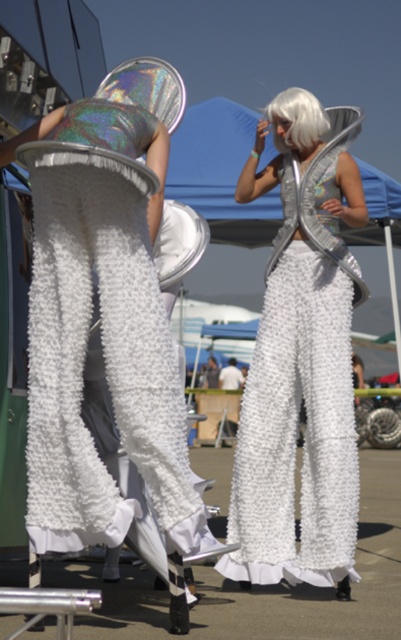
Question: Can you confirm if white fluffy pants at center is positioned to the right of white fluffy wig at upper center?

Choices:
 (A) yes
 (B) no

Answer: (B)

Question: Which object is positioned farthest from the metallic silver pole at center?

Choices:
 (A) white fluffy wig at upper center
 (B) shiny metallic vest at center
 (C) metallic silver canopy at upper center

Answer: (C)

Question: Which point is farther from the camera taking this photo?

Choices:
 (A) pos(62,224)
 (B) pos(287,106)

Answer: (B)

Question: Observing the image, what is the correct spatial positioning of white fluffy pants at center in reference to metallic silver pole at center?

Choices:
 (A) left
 (B) right

Answer: (B)

Question: Based on their relative distances, which object is farther from the white fluffy wig at upper center?

Choices:
 (A) metallic silver pole at center
 (B) metallic silver canopy at upper center
 (C) shiny metallic vest at center

Answer: (A)

Question: Does metallic silver canopy at upper center have a greater width compared to white fluffy wig at upper center?

Choices:
 (A) yes
 (B) no

Answer: (A)